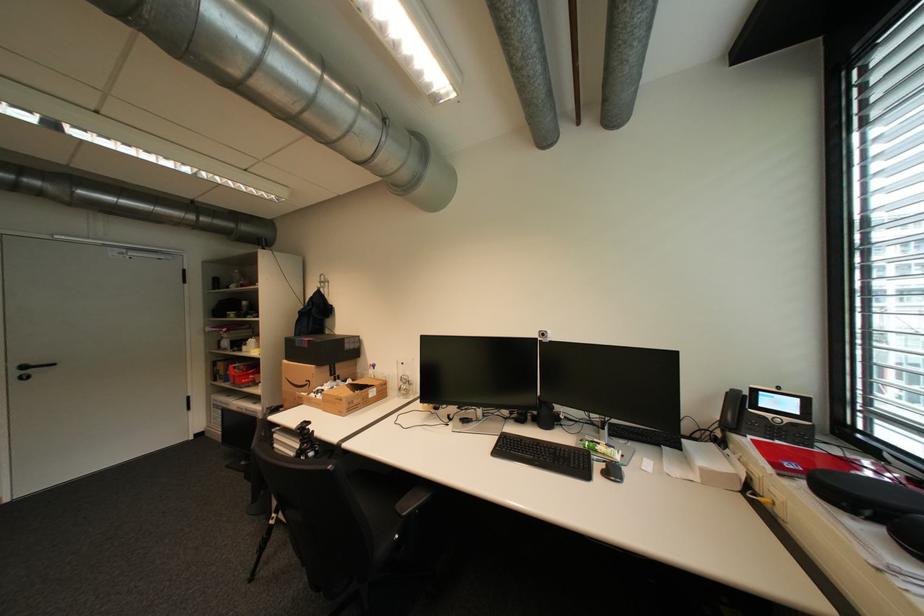
This screenshot has width=924, height=616. Describe the element at coordinates (30, 369) in the screenshot. I see `the black door handle` at that location.